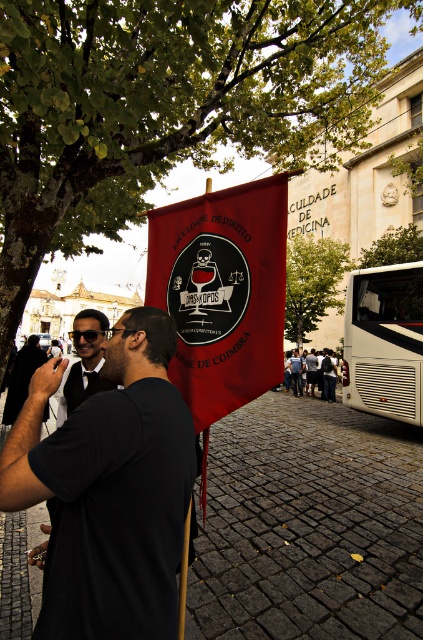
You are standing on the street in front of the banner and want to take a photo of the red matte flag at center. If your camera can focus on objects up to 2.5 meters away, will it be able to capture the flag clearly?

The red matte flag at center is 2.62 meters away from the viewer. Since the camera can focus up to 2.5 meters, it may not be able to capture the flag clearly as it is slightly beyond the maximum focusing distance.

You are a photographer adjusting your camera settings to capture the scene. The red matte flag at center and the matte black sunglasses at center are both in focus. Which object appears smaller in your photo?

The red matte flag at center appears smaller in the photo because it occupies less space than the matte black sunglasses at center.